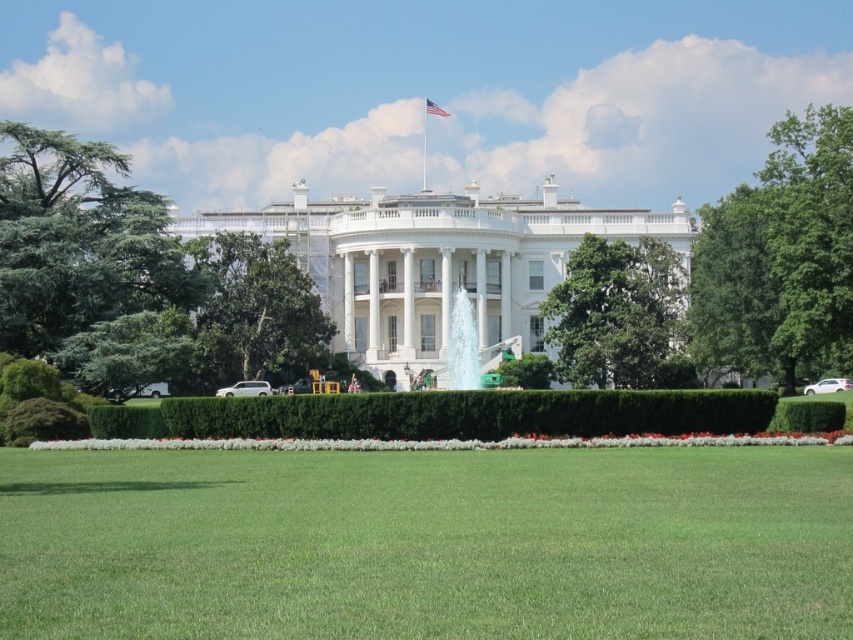
You are standing at the entrance of the White House and want to walk towards the green grass at center. Which direction should you head?

The green grass at center is located at point (427, 544) in the image, so you should head towards the center of the image to reach it.

From the picture: You are a landscape architect evaluating the White House grounds. You notice the green grass at center and the american flag at upper center. Which object has a greater height in this scene?

The green grass at center is taller than the american flag at upper center according to the description.